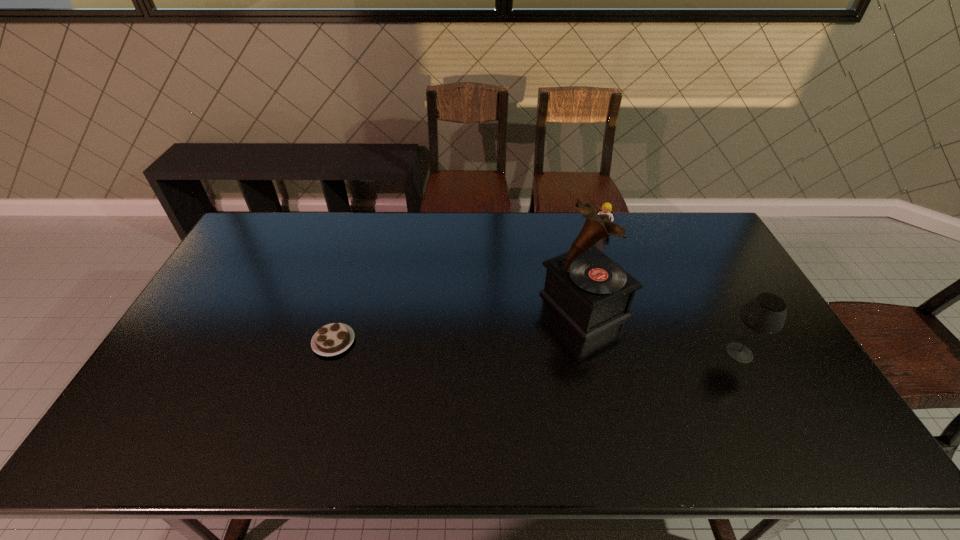
Where is `free spot on the desktop that is between the chocolate cake and the rightmost object and is positioned on the front-facing side of the Lego`? The width and height of the screenshot is (960, 540). free spot on the desktop that is between the chocolate cake and the rightmost object and is positioned on the front-facing side of the Lego is located at coordinates (578, 348).

Identify the location of free spot on the desktop that is between the leftmost object and the wineglass and is positioned at the horn opening of the phonograph_record. (497, 346).